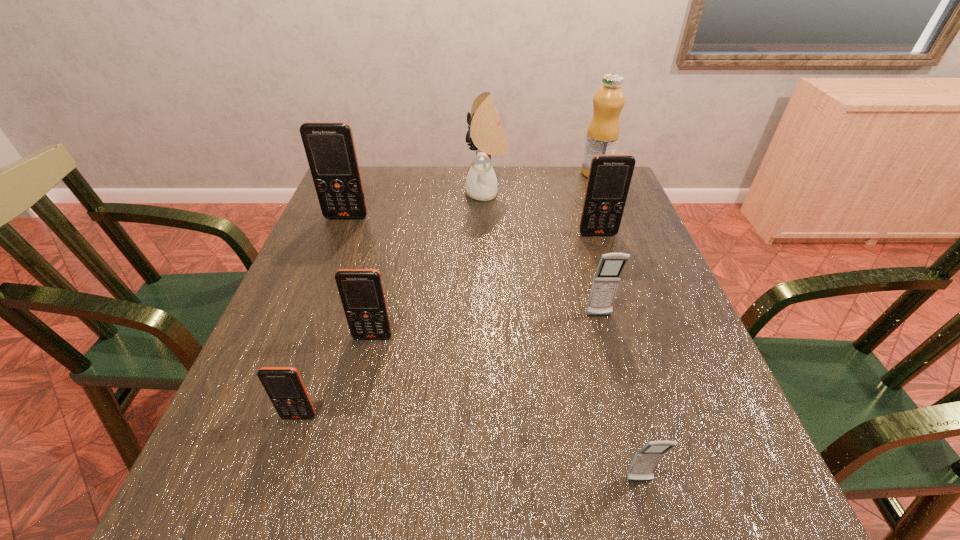
At what (x,y) coordinates should I click in order to perform the action: click on the sixth farthest object. Please return your answer as a coordinate pair (x, y). This screenshot has height=540, width=960. Looking at the image, I should click on (361, 291).

At what (x,y) coordinates should I click in order to perform the action: click on the second nearest cellular telephone. Please return your answer as a coordinate pair (x, y). Looking at the image, I should click on (283, 385).

This screenshot has height=540, width=960. Identify the location of the second nearest object. (283, 385).

Identify the location of the smaller gray cellular telephone. (646, 460).

Locate an element on the screen. This screenshot has width=960, height=540. the nearest cellular telephone is located at coordinates (646, 460).

Identify the location of free space located on the front label of the fruit juice. Image resolution: width=960 pixels, height=540 pixels. pos(521,173).

Locate an element on the screen. This screenshot has width=960, height=540. vacant space located on the front label of the fruit juice is located at coordinates (543, 173).

The image size is (960, 540). What are the coordinates of `vacant space situated 0.320m on the front label of the fruit juice` in the screenshot? It's located at (480, 173).

Identify the location of vacant space located at the front face of the doll. (384, 193).

Image resolution: width=960 pixels, height=540 pixels. I want to click on free space located 0.290m at the front face of the doll, so click(368, 193).